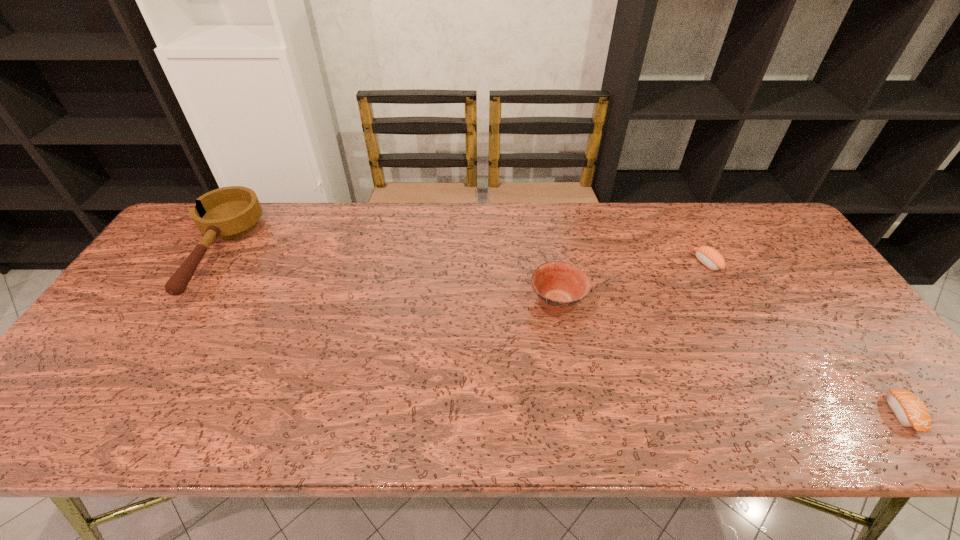
The image size is (960, 540). Find the location of `object present at the far edge`. object present at the far edge is located at coordinates (230, 212).

Where is `object located in the near edge section of the desktop`? The width and height of the screenshot is (960, 540). object located in the near edge section of the desktop is located at coordinates (909, 409).

In order to click on object located at the left edge in this screenshot , I will do `click(230, 212)`.

The image size is (960, 540). In order to click on object located in the right edge section of the desktop in this screenshot , I will do `click(909, 409)`.

Identify the location of object present at the far left corner. (230, 212).

Where is `object that is at the near right corner`? This screenshot has height=540, width=960. object that is at the near right corner is located at coordinates (909, 409).

Locate an element on the screen. This screenshot has height=540, width=960. free space at the far edge is located at coordinates (678, 232).

At what (x,y) coordinates should I click in order to perform the action: click on blank space at the near edge. Please return your answer as a coordinate pair (x, y). Image resolution: width=960 pixels, height=540 pixels. Looking at the image, I should click on (841, 409).

You are a GUI agent. You are given a task and a screenshot of the screen. Output one action in this format:
    pyautogui.click(x=<x>, y=<y>)
    Task: Click on the free space at the right edge of the desktop
    
    Given the screenshot: What is the action you would take?
    pyautogui.click(x=782, y=288)

You are a GUI agent. You are given a task and a screenshot of the screen. Output one action in this format:
    pyautogui.click(x=<x>, y=<y>)
    Task: Click on the free region at the far left corner
    
    Given the screenshot: What is the action you would take?
    pyautogui.click(x=171, y=242)